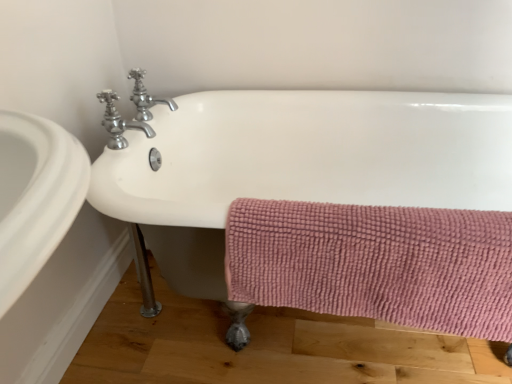
Find the location of a particular element. vacant space behind polished chrome faucet at upper left, which is the 2th tap in front-to-back order is located at coordinates pos(182,102).